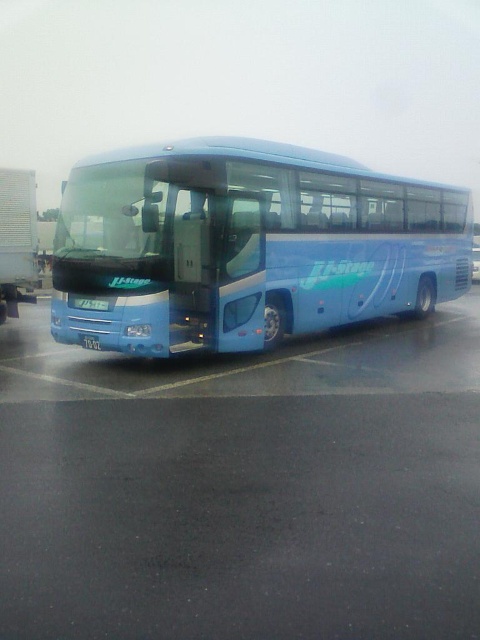
You are a delivery driver who needs to back up your truck to load cargo. You see the blue glossy bus at center and the white corrugated plastic trailer truck at left. Which vehicle is closer to you as you face the parking lot?

The blue glossy bus at center is closer to you because it is in front of the white corrugated plastic trailer truck at left, meaning the bus is nearer to your position facing the parking lot.

You are standing in the parking lot and want to walk to the point marked as point (239, 157). The bus is parked between you and that point. Can you safely walk around the bus to reach the point without going behind the bus?

The point (239, 157) is 8.77 meters away from you. Since the bus is parked between you and the point, you can safely walk around the bus to reach the point without going behind it, as long as there is enough space around the sides of the bus to navigate. However, the exact feasibility depends on the bus size and parking lot layout not specified here.

You are a delivery person who needs to park your van in the parking lot. The van requires a parking space that is at least 15 feet wide. Can you determine if there is enough space between the black asphalt parking lot at center and the white corrugated plastic trailer truck at left to park your van?

The distance between the black asphalt parking lot at center and the white corrugated plastic trailer truck at left is 21.58 feet, which is more than the required 15 feet width. Therefore, there is sufficient space to park the van.